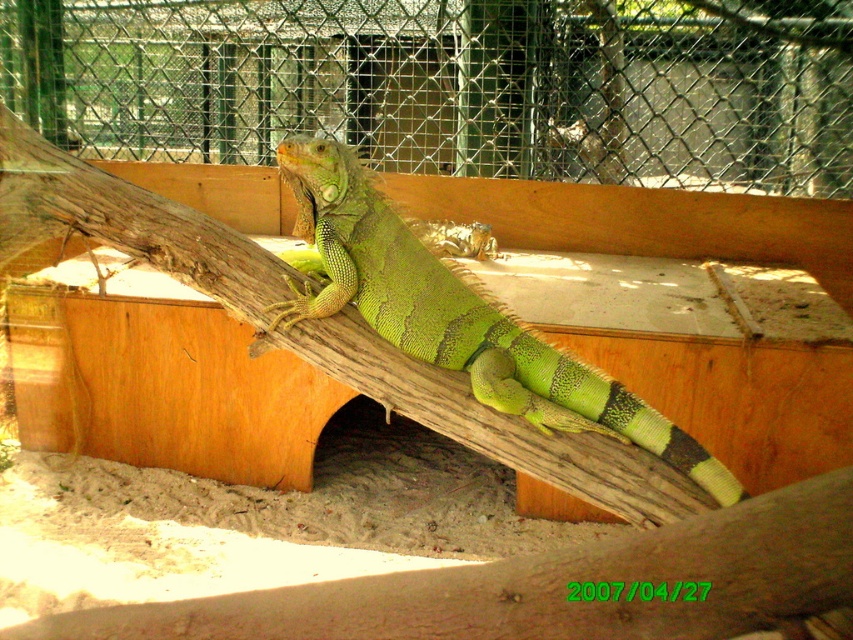
Question: Among these objects, which one is farthest from the camera?

Choices:
 (A) green scaly lizard at center
 (B) green mesh fence at upper center

Answer: (B)

Question: Does green mesh fence at upper center have a greater width compared to green scaly lizard at center?

Choices:
 (A) yes
 (B) no

Answer: (A)

Question: Which object is farther from the camera taking this photo?

Choices:
 (A) green scaly lizard at center
 (B) green mesh fence at upper center

Answer: (B)

Question: Is green mesh fence at upper center further to camera compared to green scaly lizard at center?

Choices:
 (A) no
 (B) yes

Answer: (B)

Question: Is green mesh fence at upper center above green scaly lizard at center?

Choices:
 (A) no
 (B) yes

Answer: (B)